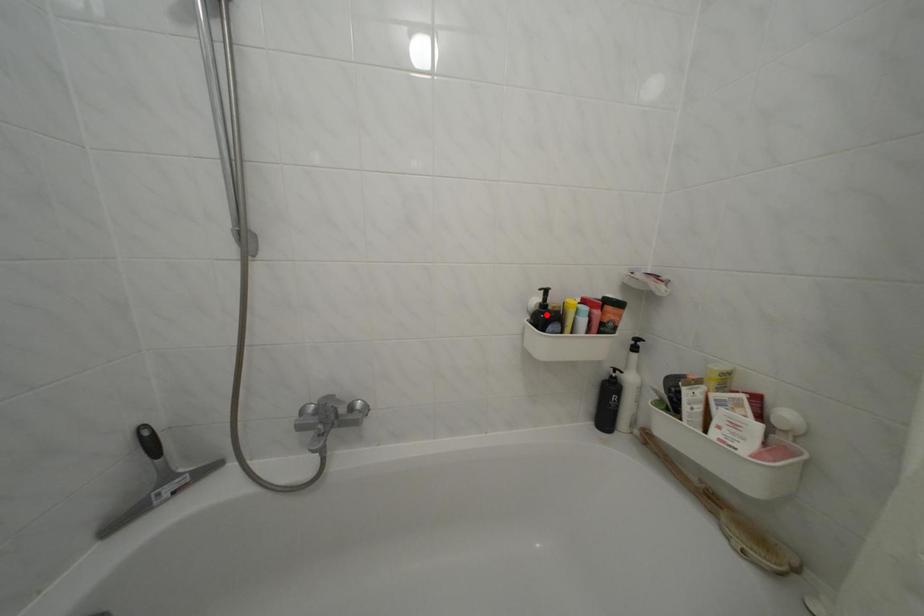
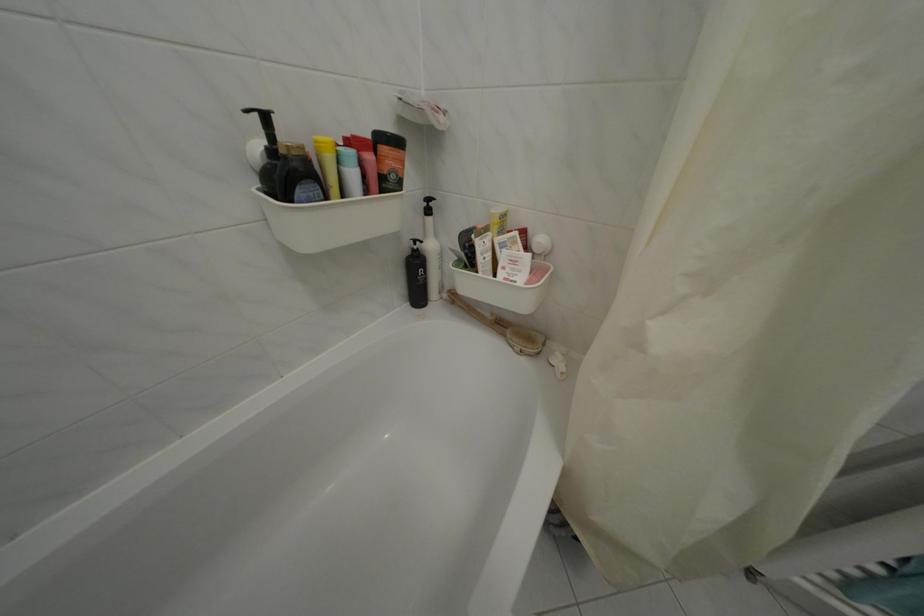
Locate, in the second image, the point that corresponds to the highlighted location in the first image.

(274, 166)